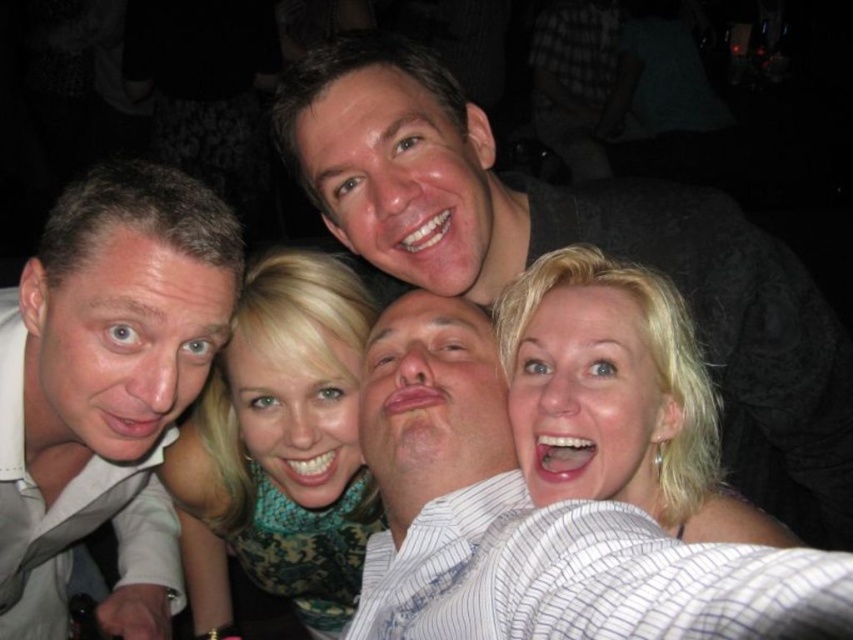
Question: Can you confirm if light brown shirt at left is bigger than teal floral scarf at center?

Choices:
 (A) no
 (B) yes

Answer: (B)

Question: Which point appears farthest from the camera in this image?

Choices:
 (A) (462, 184)
 (B) (463, 381)

Answer: (A)

Question: Does light brown shirt at left appear under blonde hair at center?

Choices:
 (A) no
 (B) yes

Answer: (B)

Question: Which of the following is the farthest from the observer?

Choices:
 (A) pos(337,392)
 (B) pos(184,214)

Answer: (A)

Question: Among these objects, which one is nearest to the camera?

Choices:
 (A) blonde hair at center
 (B) light brown shirt at left

Answer: (A)

Question: Is matte gray shirt at upper center thinner than blonde hair at center?

Choices:
 (A) yes
 (B) no

Answer: (B)